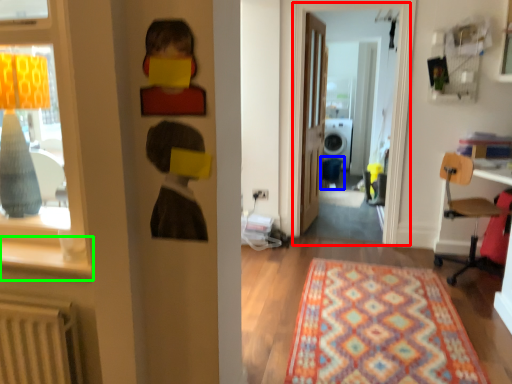
Question: Considering the real-world distances, which object is closest to window screen (highlighted by a red box)? armchair (highlighted by a blue box) or window sill (highlighted by a green box).

Choices:
 (A) armchair
 (B) window sill

Answer: (A)